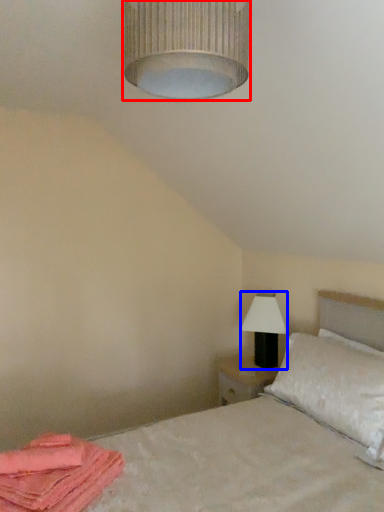
Question: Which object is closer to the camera taking this photo, lamp (highlighted by a red box) or table lamp (highlighted by a blue box)?

Choices:
 (A) lamp
 (B) table lamp

Answer: (A)